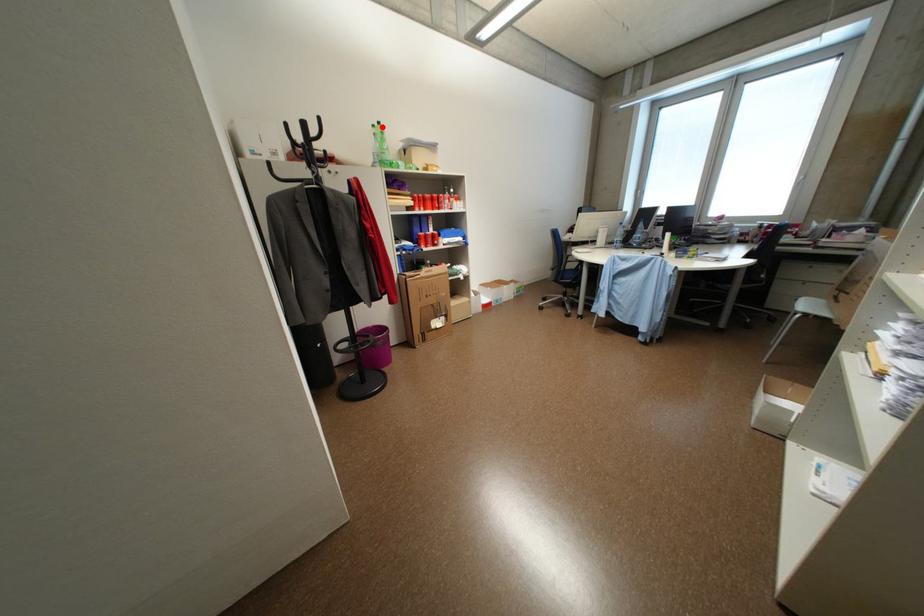
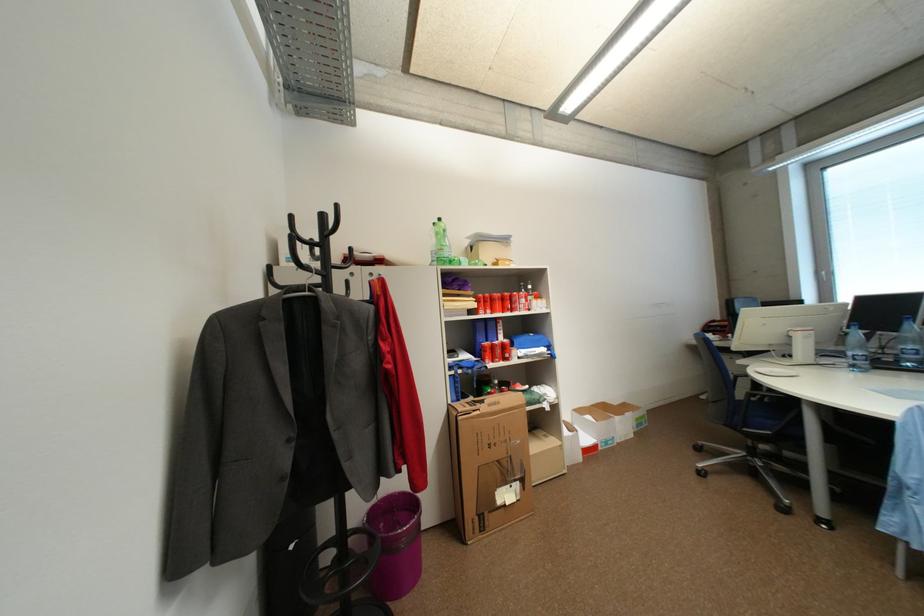
The point at the highlighted location is marked in the first image. Where is the corresponding point in the second image?

(443, 225)